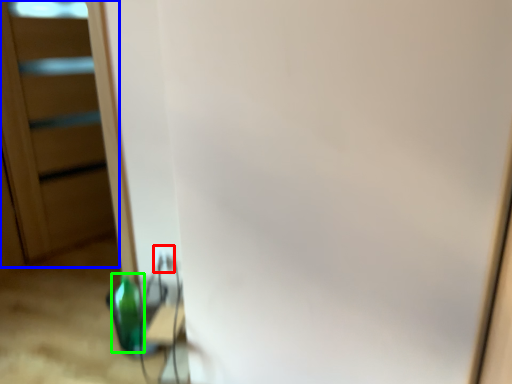
Question: Estimate the real-world distances between objects in this image. Which object is farther from electric outlet (highlighted by a red box), screen door (highlighted by a blue box) or bottle (highlighted by a green box)?

Choices:
 (A) screen door
 (B) bottle

Answer: (A)